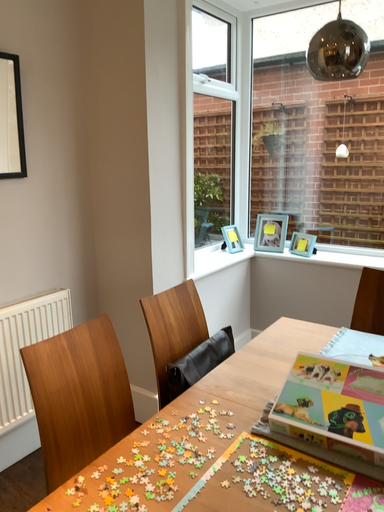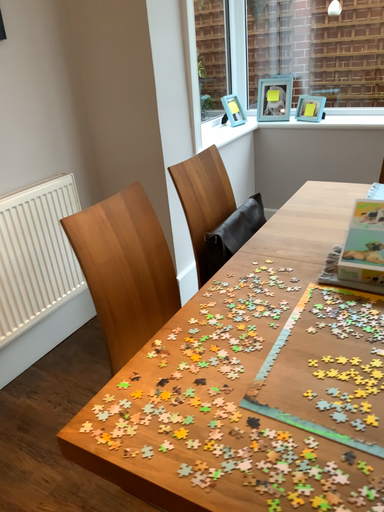
Question: Which way did the camera rotate in the video?

Choices:
 (A) rotated upward
 (B) rotated downward

Answer: (B)